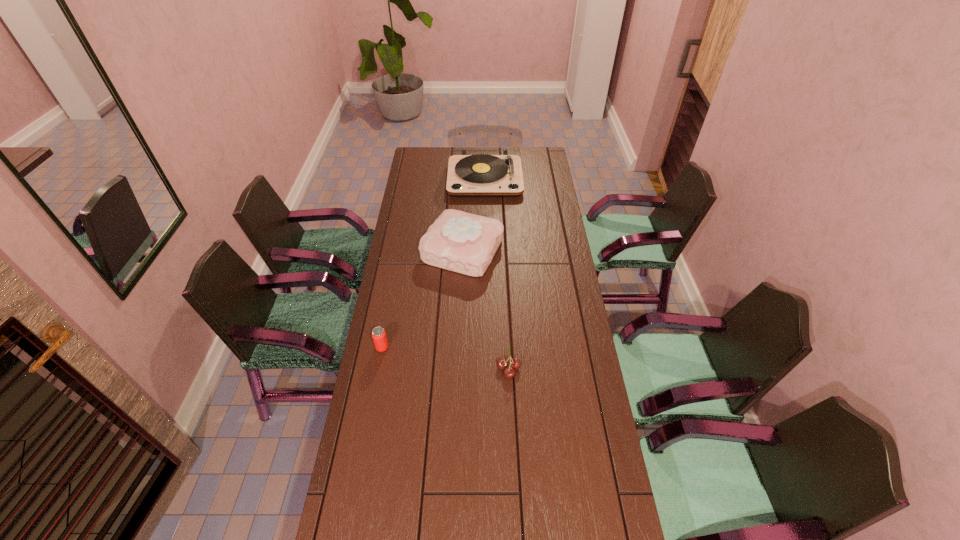
At what (x,y) coordinates should I click in order to perform the action: click on the tallest object. Please return your answer as a coordinate pair (x, y). Looking at the image, I should click on (480, 175).

The width and height of the screenshot is (960, 540). What are the coordinates of `record player` in the screenshot? It's located at (480, 175).

You are a GUI agent. You are given a task and a screenshot of the screen. Output one action in this format:
    pyautogui.click(x=<x>, y=<y>)
    Task: Click on the second farthest object
    This screenshot has width=960, height=540.
    Given the screenshot: What is the action you would take?
    pyautogui.click(x=458, y=241)

Locate an element on the screen. This screenshot has height=540, width=960. cake is located at coordinates (458, 241).

Image resolution: width=960 pixels, height=540 pixels. I want to click on beer can, so click(x=378, y=334).

Locate an element on the screen. the third farthest object is located at coordinates (378, 334).

I want to click on the shortest object, so click(509, 372).

Where is `the nearest object`? the nearest object is located at coordinates (509, 372).

In order to click on free space located 0.230m with the tonearm facing the front of the tallest object in this screenshot , I will do `click(486, 230)`.

This screenshot has width=960, height=540. I want to click on free region located on the left of the second tallest object, so click(x=403, y=250).